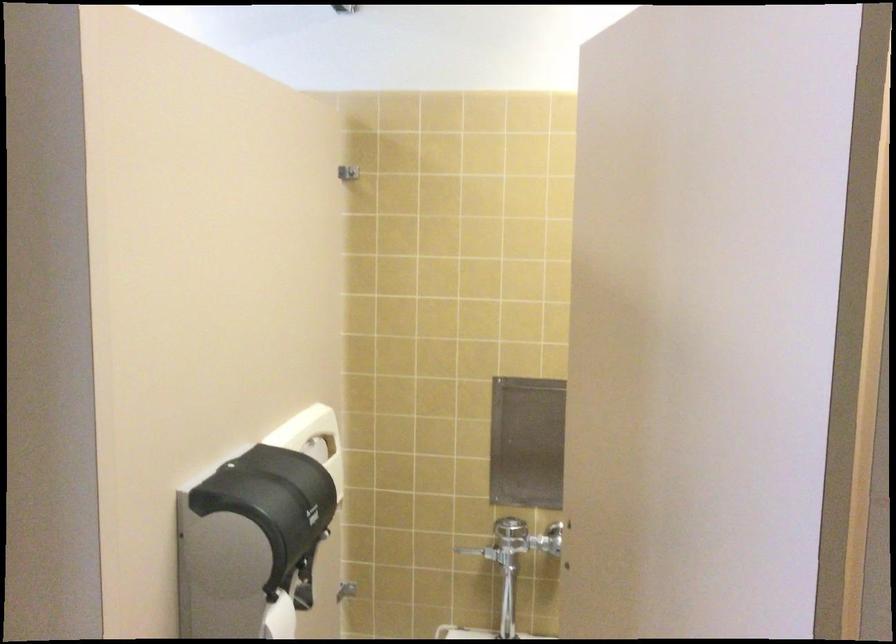
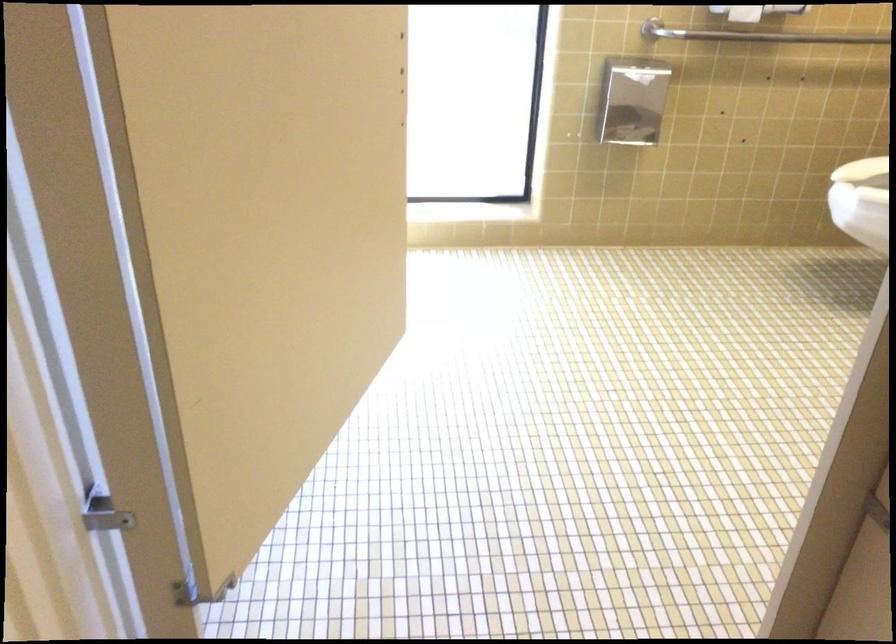
The first image is from the beginning of the video and the second image is from the end. How did the camera likely rotate when shooting the video?

The rotation direction of the camera is left-down.